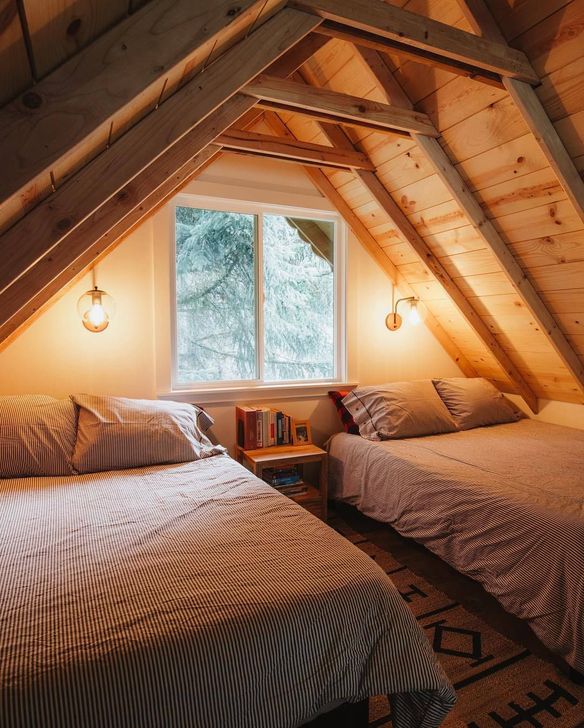
This screenshot has height=728, width=584. Identify the location of floor. (436, 582).